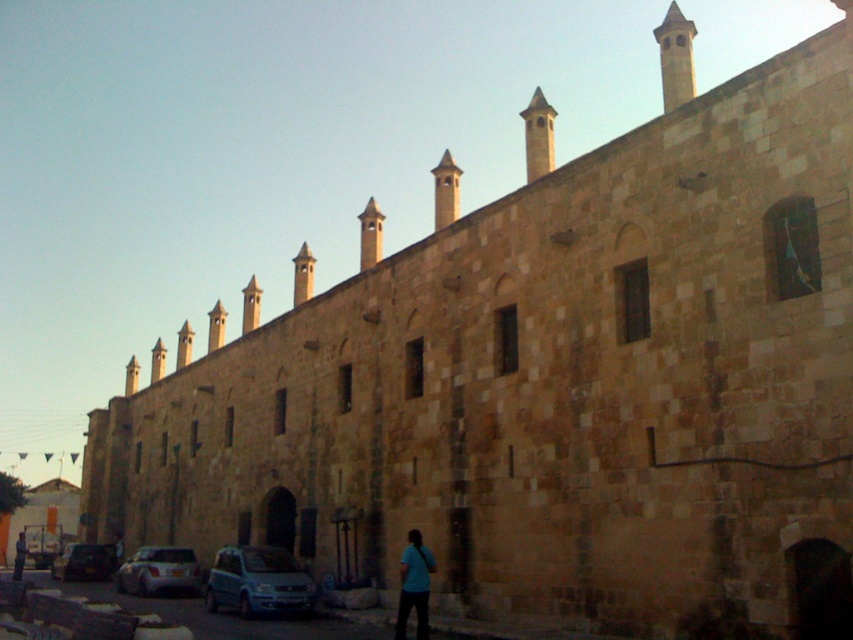
You are standing in front of the historic stone building and notice two points marked on the building facade. The first point is at coordinates point (427, 554) and the second is at point (18, 573). From your perspective, which point is closer to you?

Point (427, 554) is in front of point (18, 573), so it is closer to you.

You are standing at the entrance of the historic stone building and want to park your blue metallic van at lower center. The parking spot is located at coordinate point 0.909, 0.304. Can you determine if the van is already parked in the correct spot?

The blue metallic van at lower center is positioned at point (258, 580), so yes, it is parked in the correct spot.